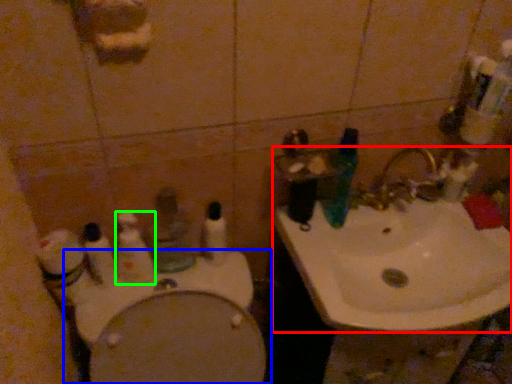
Question: Considering the real-world distances, which object is closest to sink (highlighted by a red box)? toilet (highlighted by a blue box) or toothbrush (highlighted by a green box).

Choices:
 (A) toilet
 (B) toothbrush

Answer: (A)